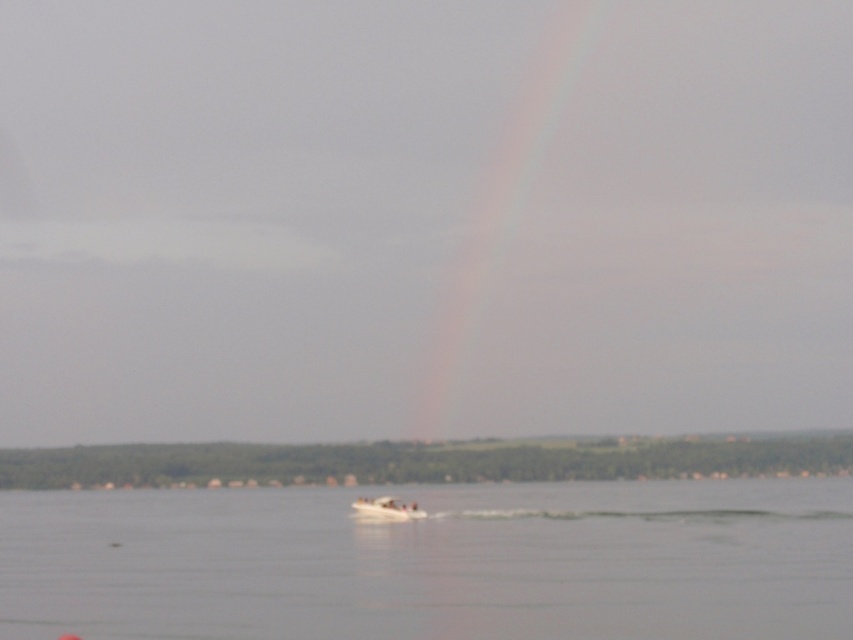
You are standing on the lakeside and want to throw a stone to hit the white plastic boat at center. The clear water at lower center is between you and the boat. If your stone can travel 30 meters, will it reach the boat?

The distance between the clear water at lower center and the white plastic boat at center is 27.69 meters. Since your stone can travel 30 meters, it will reach the boat.

You are an observer standing at the lakeside and see the clear water at lower center and the rainbow at center. Which object is taller in the scene?

The rainbow at center is taller than the clear water at lower center.

You are a photographer standing on the lakeside and want to capture both the rainbow at center and the white plastic boat at center in the same frame. Given that your camera has a maximum zoom range of 100 meters, can you fit both objects in the frame without moving your position?

The distance between the rainbow at center and the white plastic boat at center is 138.60 meters. Since the camera can only zoom up to 100 meters, the photographer cannot fit both objects in the frame without moving closer.